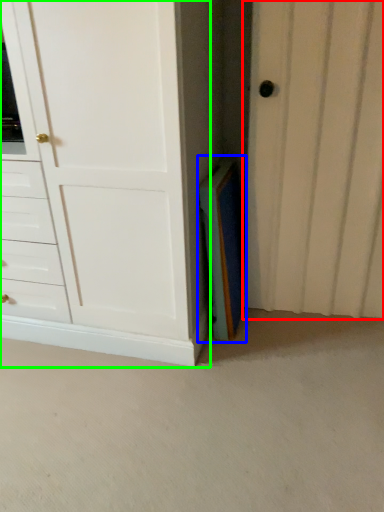
Question: Estimate the real-world distances between objects in this image. Which object is farther from door (highlighted by a red box), paperback book (highlighted by a blue box) or chest of drawers (highlighted by a green box)?

Choices:
 (A) paperback book
 (B) chest of drawers

Answer: (B)